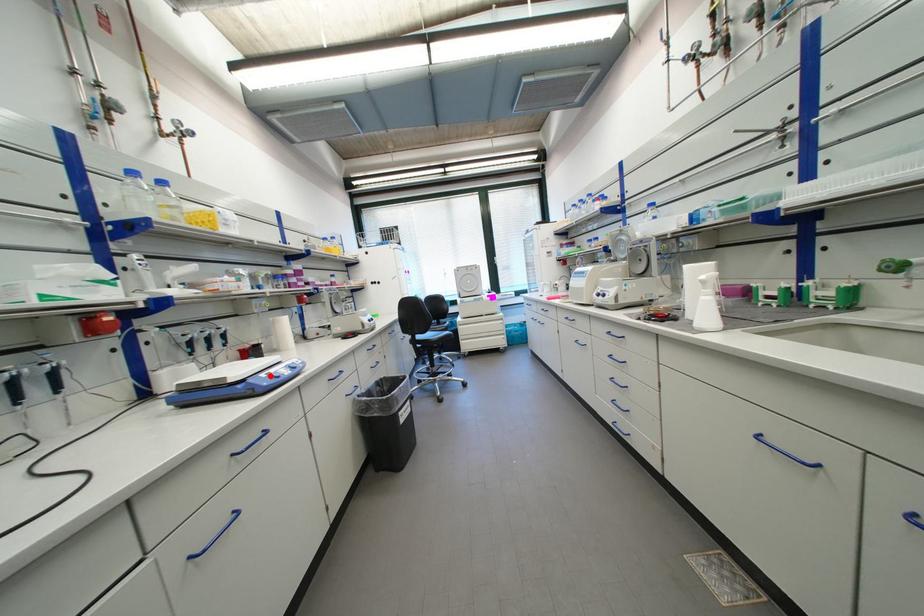
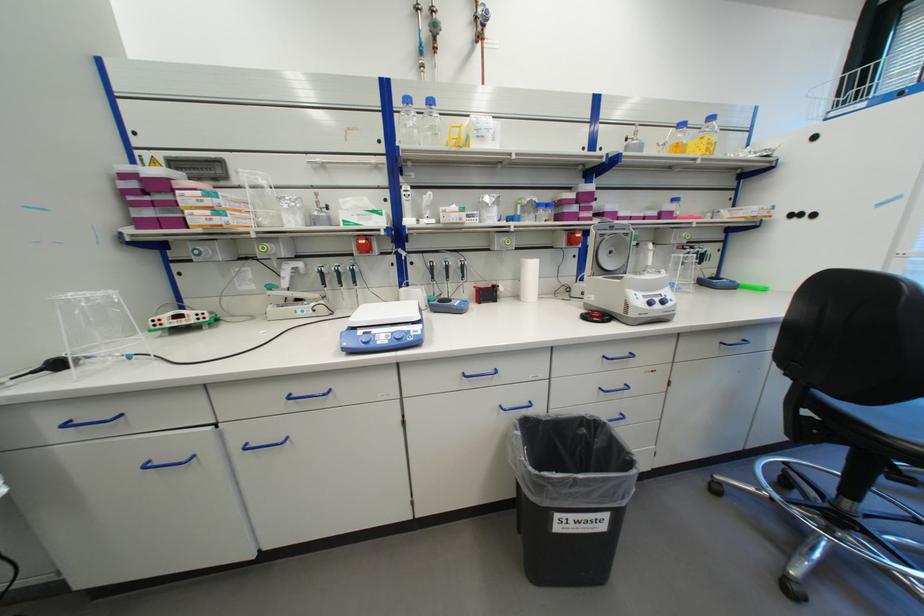
Where in the second image is the point corresponding to the highlighted location from the first image?

(369, 333)